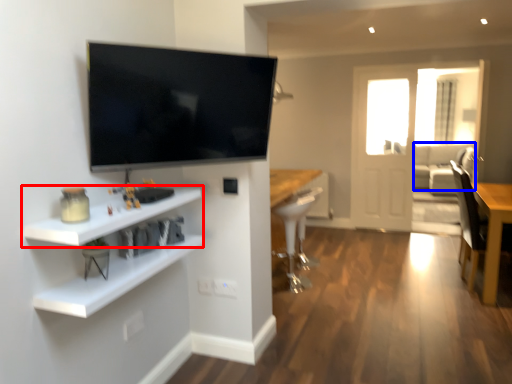
Question: Which of the following is the closest to the observer, shelf (highlighted by a red box) or couch (highlighted by a blue box)?

Choices:
 (A) shelf
 (B) couch

Answer: (A)